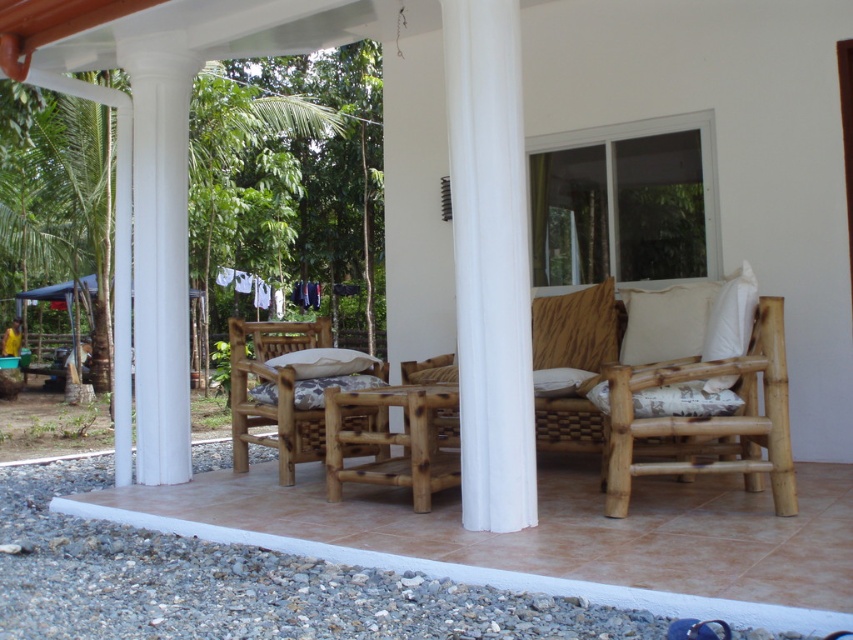
You are standing at the camera position looking at the patio. There is a point marked at coordinates point (364, 417). Can you estimate how far this point is from your current position?

The point (364, 417) is 5.60 meters away from the camera, so the distance is 5.60 meters.

You are standing on the patio and want to place a small potted plant between the white smooth column at center and the white textured pillow at center. Which object should the plant be closer to if you want it to be nearer to the viewer?

The plant should be placed closer to the white smooth column at center since it is already closer to the viewer compared to the white textured pillow at center.

You are planning to place a new plant stand on the patio. The plant stand is 1 meter tall. The natural wood rocking chair at center and the white textured pillow at center are in the way. Which object do you need to move to make space for the plant stand?

The natural wood rocking chair at center is positioned under the white textured pillow at center. To place the plant stand, you need to move the natural wood rocking chair at center first since it is underneath the pillow and moving it would create space.